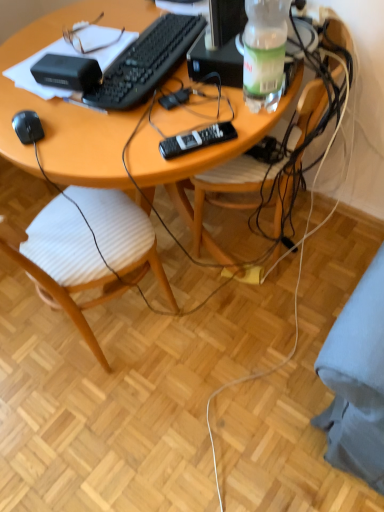
Where is `free spot in front of wooden chair at center, marked as the first chair in a left-to-right arrangement`? This screenshot has width=384, height=512. free spot in front of wooden chair at center, marked as the first chair in a left-to-right arrangement is located at coordinates (116, 414).